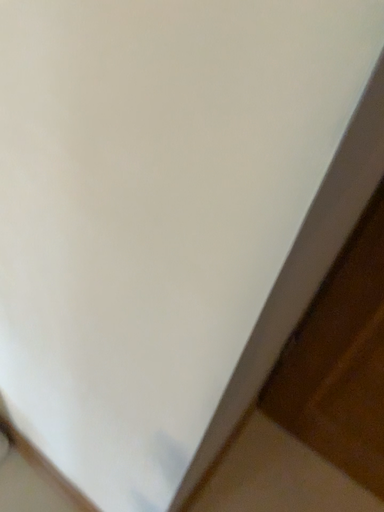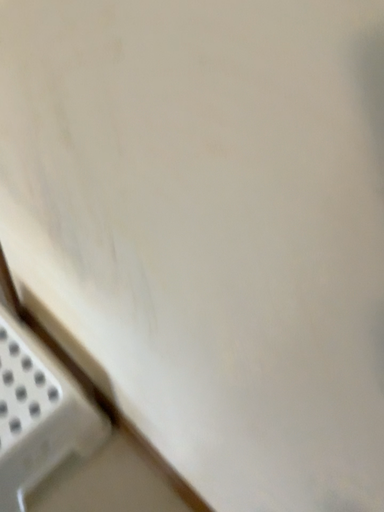
Question: How did the camera likely rotate when shooting the video?

Choices:
 (A) rotated downward
 (B) rotated upward

Answer: (A)